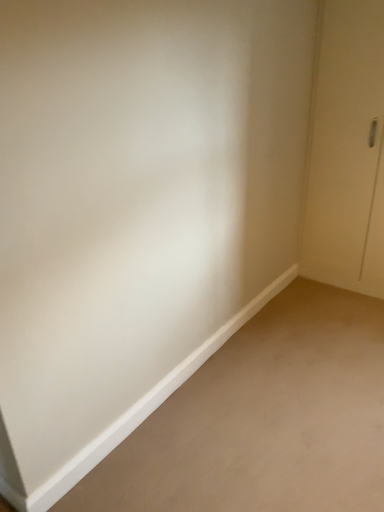
Where is `free space in front of white matte door at right`? This screenshot has width=384, height=512. free space in front of white matte door at right is located at coordinates (348, 308).